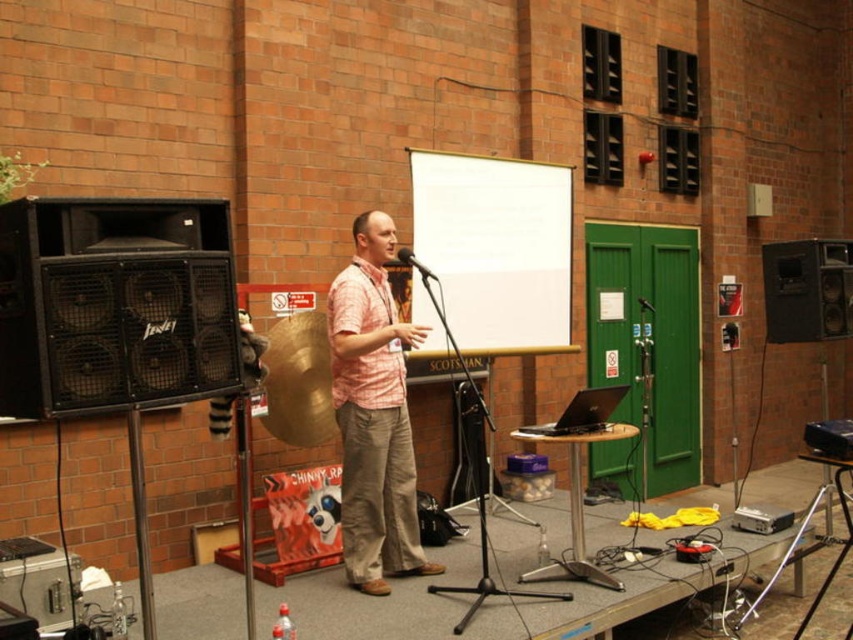
Is pink checkered shirt at center shorter than matte black microphone at center?

In fact, pink checkered shirt at center may be taller than matte black microphone at center.

I want to click on pink checkered shirt at center, so click(x=373, y=413).

Is the position of white matte projection screen at center more distant than that of pink checkered shirt at center?

Yes, it is behind pink checkered shirt at center.

Does point (480, 250) lie in front of point (393, 339)?

No, (480, 250) is further to viewer.

Describe the element at coordinates (495, 248) in the screenshot. I see `white matte projection screen at center` at that location.

Where is `white matte projection screen at center`? white matte projection screen at center is located at coordinates (495, 248).

Based on the photo, does pink checkered shirt at center appear on the right side of silver metallic laptop at center?

In fact, pink checkered shirt at center is to the left of silver metallic laptop at center.

Between pink checkered shirt at center and silver metallic laptop at center, which one is positioned higher?

pink checkered shirt at center

Does point (405, 417) come farther from viewer compared to point (563, 422)?

Yes, it is behind point (563, 422).

Image resolution: width=853 pixels, height=640 pixels. Find the location of `pink checkered shirt at center`. pink checkered shirt at center is located at coordinates (373, 413).